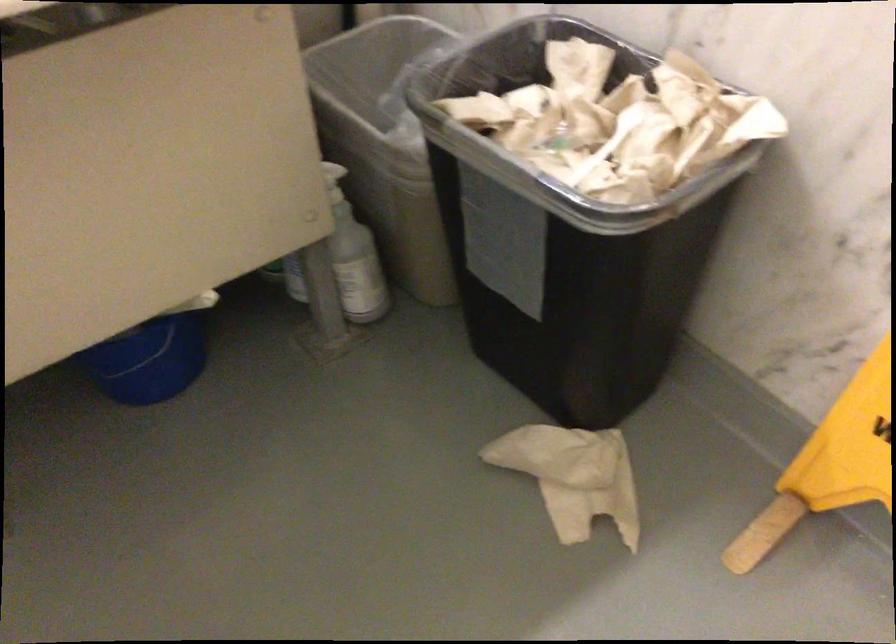
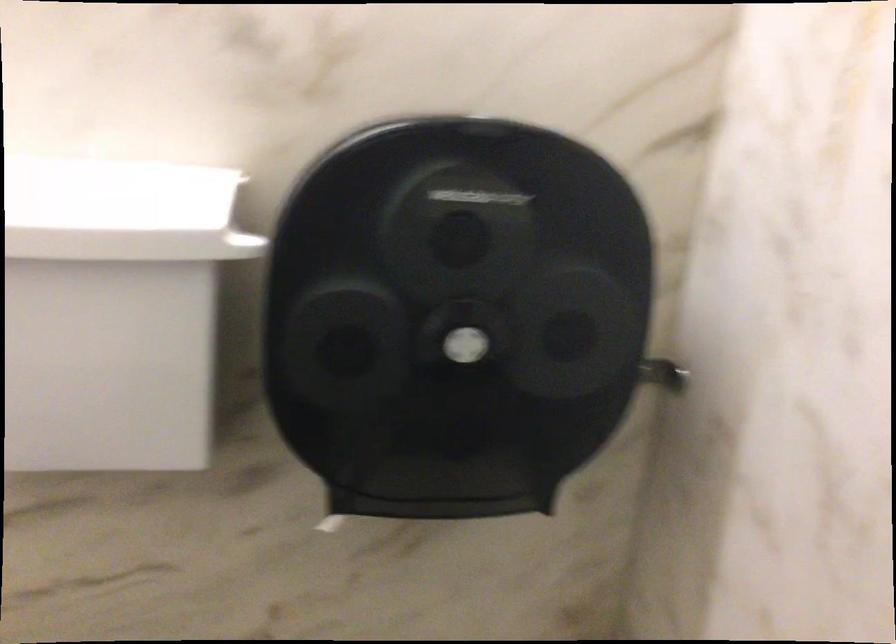
How did the camera likely rotate?

The rotation direction of the camera is left-up.